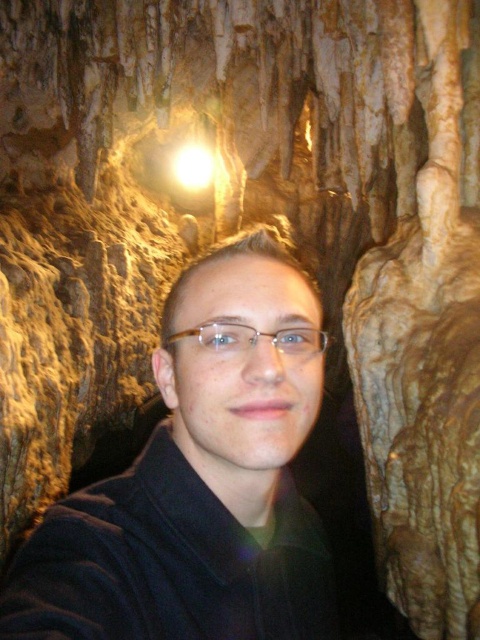
Looking at this image, is black matte jacket at center wider than clear plastic glasses at center?

Yes.

Is point (156, 452) positioned behind point (231, 339)?

Yes, point (156, 452) is farther from viewer.

Between point (207, 369) and point (248, 340), which one is positioned behind?

The point (207, 369) is behind.

Where is `black matte jacket at center`? black matte jacket at center is located at coordinates (201, 477).